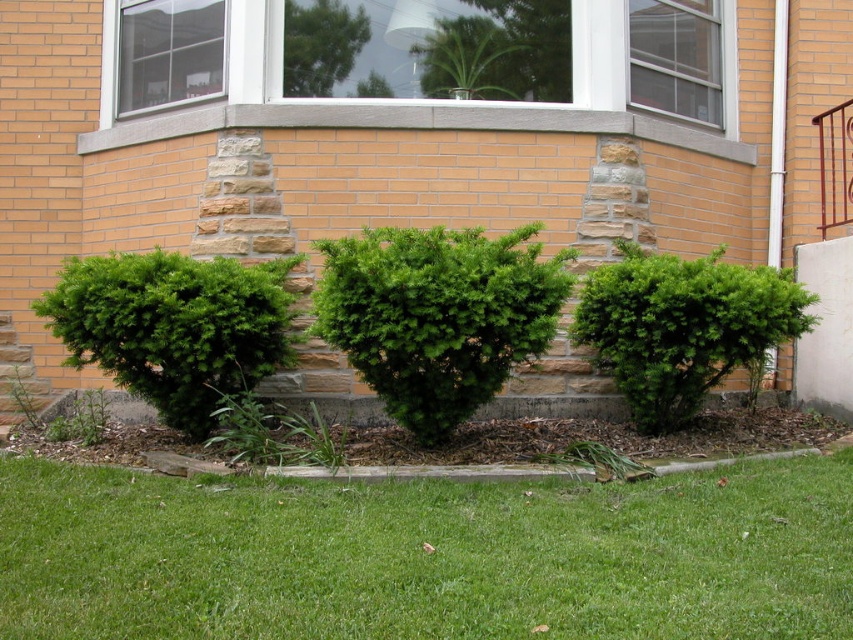
You are a gardener planning to water the green textured shrub at center and the green textured bush at left. Which one should you water first if you want to start from the left side of the shrubs?

The green textured bush at left should be watered first since it is positioned on the left side of the green textured shrub at center.